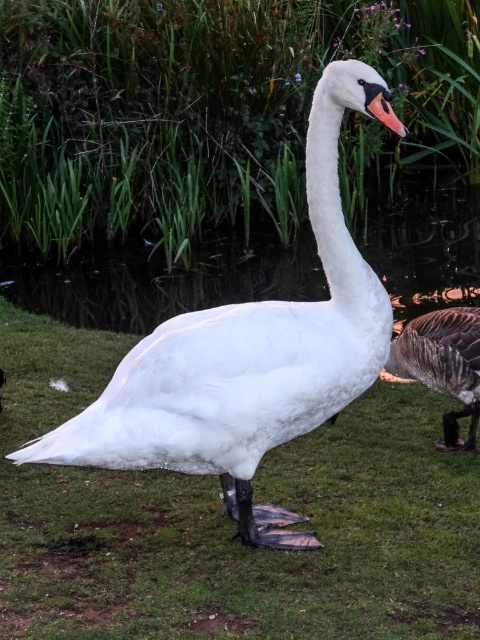
Is white matte grass at center taller than white glossy swan at center?

In fact, white matte grass at center may be shorter than white glossy swan at center.

Does white matte grass at center have a larger size compared to white glossy swan at center?

Correct, white matte grass at center is larger in size than white glossy swan at center.

Locate an element on the screen. The height and width of the screenshot is (640, 480). white matte grass at center is located at coordinates (230, 522).

Consider the image. Can you confirm if white matte grass at center is positioned below orange glossy beak at center?

Indeed, white matte grass at center is positioned under orange glossy beak at center.

Which is above, white matte grass at center or orange glossy beak at center?

orange glossy beak at center

Is point (416, 413) farther from viewer compared to point (377, 116)?

Yes.

At what (x,y) coordinates should I click in order to perform the action: click on white matte grass at center. Please return your answer as a coordinate pair (x, y). This screenshot has height=640, width=480. Looking at the image, I should click on (230, 522).

Between white matte grass at center and gray matte duck at right, which one has less height?

gray matte duck at right is shorter.

Does white matte grass at center appear on the left side of gray matte duck at right?

Indeed, white matte grass at center is positioned on the left side of gray matte duck at right.

Measure the distance between point (302, 616) and camera.

A distance of 2.56 meters exists between point (302, 616) and camera.

Find the location of `white matte grass at center`. white matte grass at center is located at coordinates (230, 522).